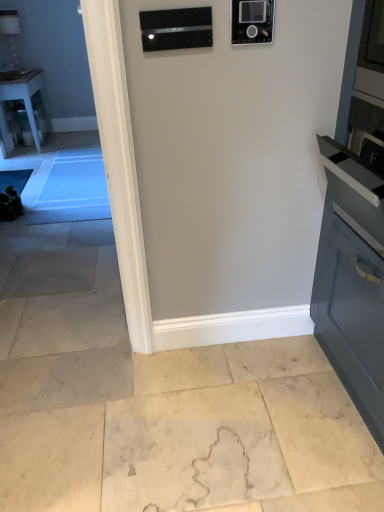
Question: From a real-world perspective, is clear glass table at left positioned under black glass microwave at upper center, which is counted as the first appliance, starting from the left, based on gravity?

Choices:
 (A) no
 (B) yes

Answer: (B)

Question: Can you confirm if clear glass table at left is thinner than black glass microwave at upper center, which is counted as the first appliance, starting from the left?

Choices:
 (A) no
 (B) yes

Answer: (A)

Question: Does clear glass table at left have a larger size compared to black glass microwave at upper center, which is counted as the first appliance, starting from the left?

Choices:
 (A) no
 (B) yes

Answer: (B)

Question: Are clear glass table at left and black glass microwave at upper center, placed as the 2th appliance when sorted from right to left, beside each other?

Choices:
 (A) yes
 (B) no

Answer: (B)

Question: Is clear glass table at left smaller than black glass microwave at upper center, which is counted as the first appliance, starting from the left?

Choices:
 (A) no
 (B) yes

Answer: (A)

Question: Considering the relative positions of clear glass table at left and black glass microwave at upper center, which is counted as the first appliance, starting from the left, in the image provided, is clear glass table at left to the right of black glass microwave at upper center, which is counted as the first appliance, starting from the left, from the viewer's perspective?

Choices:
 (A) no
 (B) yes

Answer: (A)

Question: Is beige marble floor at lower center placed right next to black glass microwave at upper center, placed as the 2th appliance when sorted from right to left?

Choices:
 (A) yes
 (B) no

Answer: (B)

Question: From a real-world perspective, is beige marble floor at lower center physically below black glass microwave at upper center, which is counted as the first appliance, starting from the left?

Choices:
 (A) yes
 (B) no

Answer: (A)

Question: Is beige marble floor at lower center looking in the opposite direction of black glass microwave at upper center, placed as the 2th appliance when sorted from right to left?

Choices:
 (A) yes
 (B) no

Answer: (B)

Question: Considering the relative sizes of beige marble floor at lower center and black glass microwave at upper center, placed as the 2th appliance when sorted from right to left, in the image provided, is beige marble floor at lower center smaller than black glass microwave at upper center, placed as the 2th appliance when sorted from right to left,?

Choices:
 (A) yes
 (B) no

Answer: (B)

Question: Is beige marble floor at lower center at the left side of black glass microwave at upper center, which is counted as the first appliance, starting from the left?

Choices:
 (A) no
 (B) yes

Answer: (B)

Question: Considering the relative sizes of beige marble floor at lower center and black glass microwave at upper center, which is counted as the first appliance, starting from the left, in the image provided, is beige marble floor at lower center wider than black glass microwave at upper center, which is counted as the first appliance, starting from the left,?

Choices:
 (A) yes
 (B) no

Answer: (A)

Question: Is black glass microwave at upper center, which is counted as the first appliance, starting from the left, thinner than clear glass table at left?

Choices:
 (A) yes
 (B) no

Answer: (A)